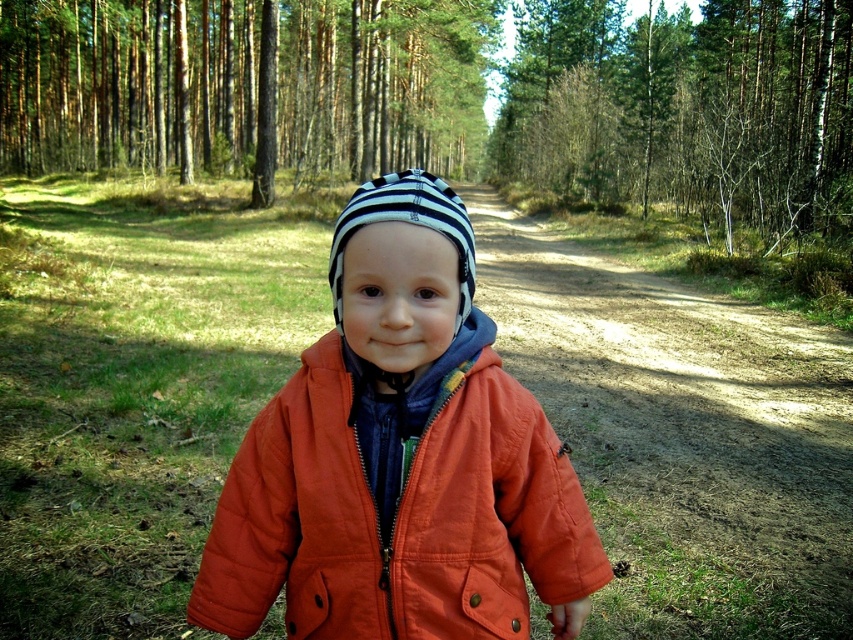
Looking at this image, measure the distance between orange quilted jacket at center and smooth brown tree trunk at center.

orange quilted jacket at center is 33.42 meters from smooth brown tree trunk at center.

Where is `orange quilted jacket at center`? orange quilted jacket at center is located at coordinates (399, 458).

Locate an element on the screen. orange quilted jacket at center is located at coordinates (399, 458).

Can you confirm if smooth brown tree trunk at center is positioned below green leafy tree at upper center?

Actually, smooth brown tree trunk at center is above green leafy tree at upper center.

Which is in front, point (337, 42) or point (770, 132)?

Point (770, 132) is in front.

Image resolution: width=853 pixels, height=640 pixels. Describe the element at coordinates (244, 84) in the screenshot. I see `smooth brown tree trunk at center` at that location.

The height and width of the screenshot is (640, 853). What are the coordinates of `smooth brown tree trunk at center` in the screenshot? It's located at (244, 84).

Is orange quilted jacket at center thinner than green leafy tree at upper center?

Yes, orange quilted jacket at center is thinner than green leafy tree at upper center.

Is the position of orange quilted jacket at center less distant than that of green leafy tree at upper center?

Yes, it is in front of green leafy tree at upper center.

Who is more distant from viewer, (287,589) or (828,166)?

Point (828,166)

This screenshot has height=640, width=853. What are the coordinates of `orange quilted jacket at center` in the screenshot? It's located at (399, 458).